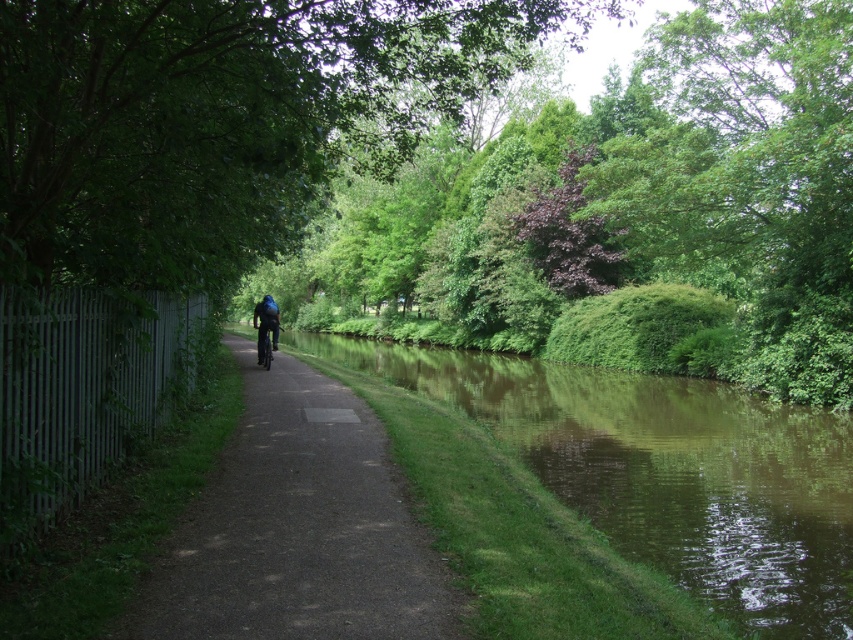
Who is more forward, (595,108) or (505,413)?

Positioned in front is point (505,413).

Does green leafy tree at center appear on the right side of green reflective water at center?

Indeed, green leafy tree at center is positioned on the right side of green reflective water at center.

What are the coordinates of `green leafy tree at center` in the screenshot? It's located at (625, 214).

Does green leafy tree at center have a greater width compared to green leafy tree at upper center?

Yes.

Does green leafy tree at center come in front of green leafy tree at upper center?

No, it is behind green leafy tree at upper center.

Which is behind, point (793, 260) or point (322, 150)?

Point (793, 260)

You are a GUI agent. You are given a task and a screenshot of the screen. Output one action in this format:
    pyautogui.click(x=<x>, y=<y>)
    Task: Click on the green leafy tree at center
    
    Given the screenshot: What is the action you would take?
    pyautogui.click(x=625, y=214)

Does point (376, 33) lie behind point (270, 320)?

No.

Between green leafy tree at upper center and shiny metallic bicycle at center, which one is positioned lower?

shiny metallic bicycle at center

Describe the element at coordinates (221, 120) in the screenshot. Image resolution: width=853 pixels, height=640 pixels. I see `green leafy tree at upper center` at that location.

This screenshot has height=640, width=853. What are the coordinates of `green leafy tree at upper center` in the screenshot? It's located at [221, 120].